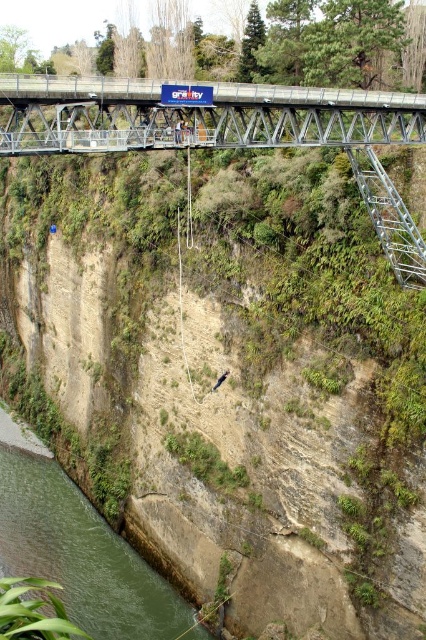
You are a bungee jumper about to jump from the bridge. You notice a point marked at coordinates (195, 115) in the scene. Where is this point located?

The point at coordinates (195, 115) corresponds to the metallic gray bridge at upper center.

You are a safety inspector evaluating the bungee jumping setup. The bungee cord must have a minimum length of 100 meters to ensure safety. Given the distance between the metallic gray bridge at upper center and the green concrete river at lower left, do you think the current bungee cord length is sufficient?

The metallic gray bridge at upper center is much taller than the green concrete river at lower left. However, without knowing the exact height difference, it is impossible to determine if the bungee cord length of 100 meters is sufficient. Additional measurements are required.